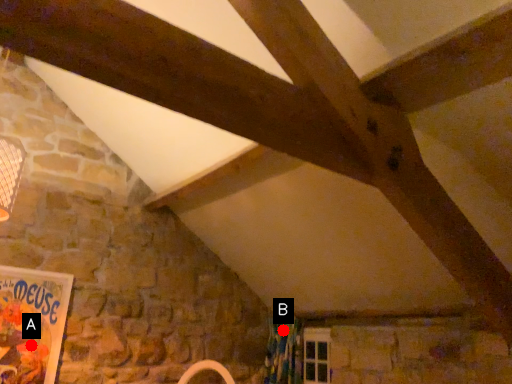
Question: Two points are circled on the image, labeled by A and B beside each circle. Which of the following is the closest to the observer?

Choices:
 (A) A is closer
 (B) B is closer

Answer: (A)